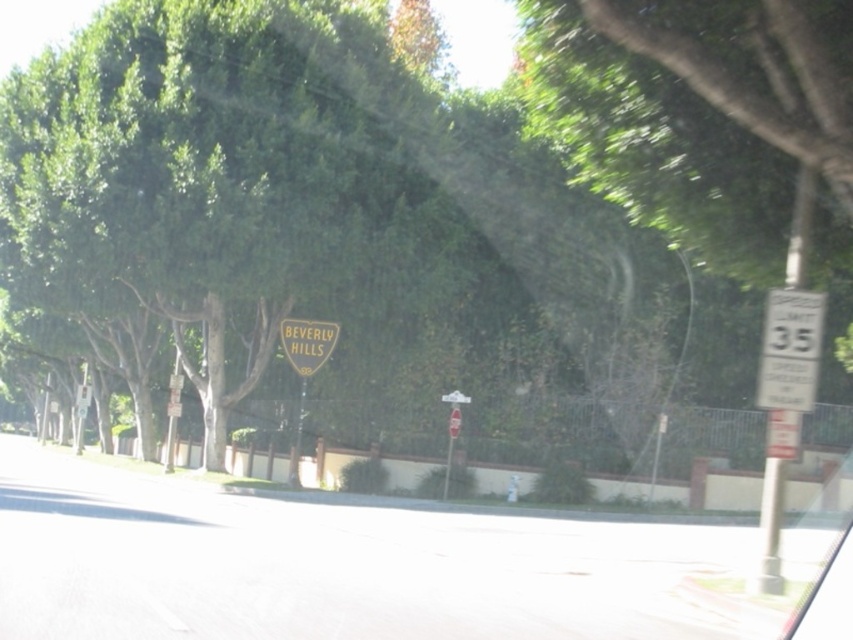
Based on the photo, you are driving a car and see the point marked at coordinate (790, 349). What object does this point correspond to?

The point at coordinate (790, 349) corresponds to the white plastic speed limit sign at right.